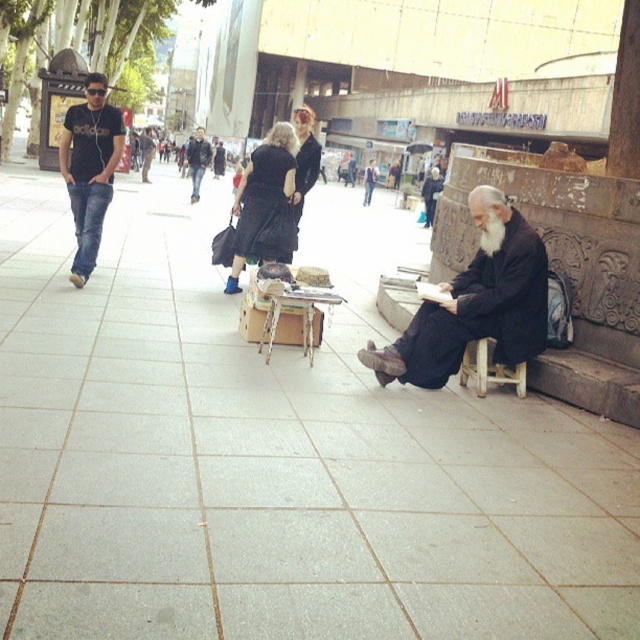
Question: Can you confirm if wooden at lower right is positioned to the right of white fluffy beard at lower right?

Choices:
 (A) yes
 (B) no

Answer: (A)

Question: Which point appears farthest from the camera in this image?

Choices:
 (A) (76, 182)
 (B) (477, 355)
 (C) (316, 141)
 (D) (196, 176)

Answer: (D)

Question: Which object is closer to the camera taking this photo?

Choices:
 (A) matte black t-shirt at left
 (B) black matte robe at center
 (C) black matte robe at lower right

Answer: (C)

Question: Does black matte robe at lower right appear over black matte dress at center?

Choices:
 (A) yes
 (B) no

Answer: (B)

Question: Which point is closer to the camera?

Choices:
 (A) (209, 161)
 (B) (307, 156)
 (C) (246, 168)

Answer: (C)

Question: Is black matte robe at lower right bigger than jeans at center?

Choices:
 (A) yes
 (B) no

Answer: (B)